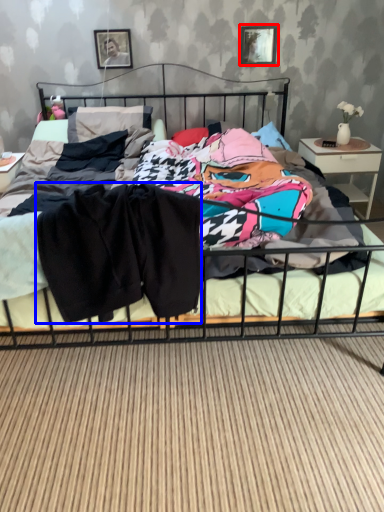
Question: Which object is further to the camera taking this photo, picture frame (highlighted by a red box) or clothing (highlighted by a blue box)?

Choices:
 (A) picture frame
 (B) clothing

Answer: (A)